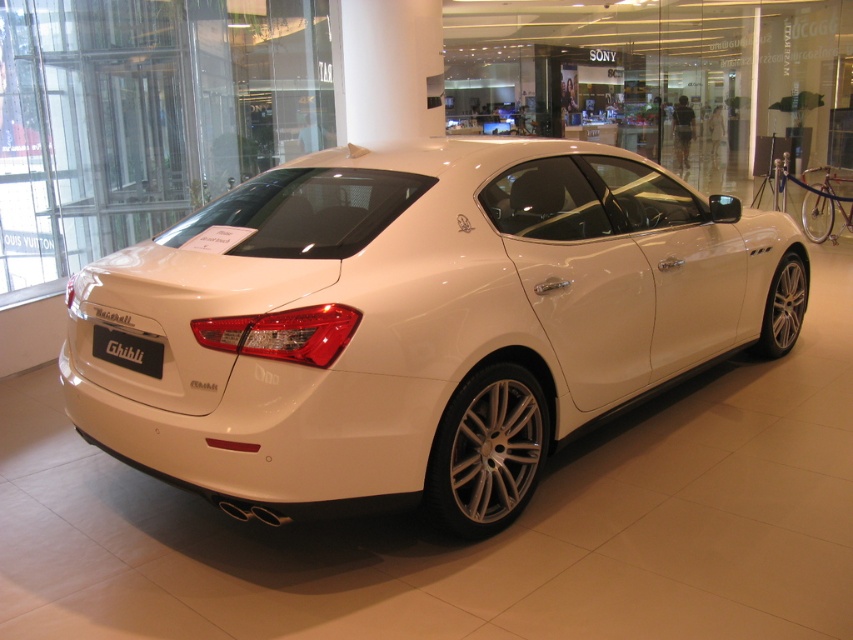
You are a parking assistant trying to align the white metallic car at center with the black matte license plate at rear. Based on the scene, which object should you move first to ensure proper alignment?

The white metallic car at center is in front of the black matte license plate at rear, so you should move the white metallic car at center first to align it properly with the license plate.

You are standing in front of the white Maserati Ghibli in the showroom. There are two points marked on the car, one at point coordinates (560, 388) and another at (148, 371). If you were to touch both points simultaneously with your fingertips, which point would feel closer to your hand?

Point (560, 388) is further to the viewer than point (148, 371), so when touching both points simultaneously, the point at (560, 388) would feel closer to your hand since it is nearer to you.

You are a delivery person who needs to load a package onto a delivery truck that is 2.5 meters wide. You are standing in front of the white metallic car at center. Can you safely maneuver the truck into the space next to the car without hitting it?

The white metallic car at center is 2.46 meters from the camera, so the distance between the car and the truck would be sufficient as the truck is only 2.5 meters wide, allowing safe maneuvering without collision.